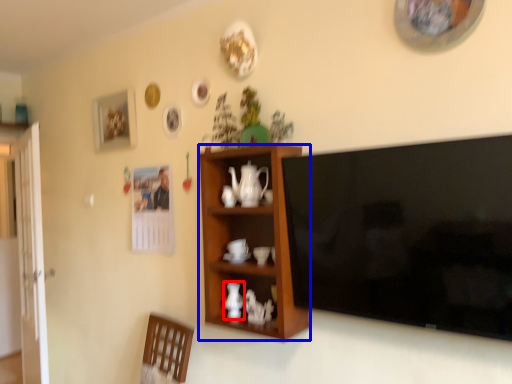
Question: Which of the following is the closest to the observer, vase (highlighted by a red box) or cabinetry (highlighted by a blue box)?

Choices:
 (A) vase
 (B) cabinetry

Answer: (B)